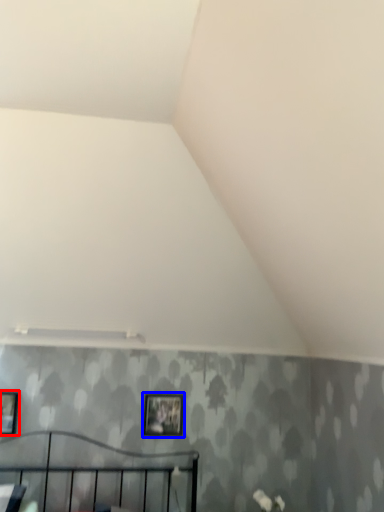
Question: Which point is closer to the camera, picture frame (highlighted by a red box) or picture frame (highlighted by a blue box)?

Choices:
 (A) picture frame
 (B) picture frame

Answer: (A)